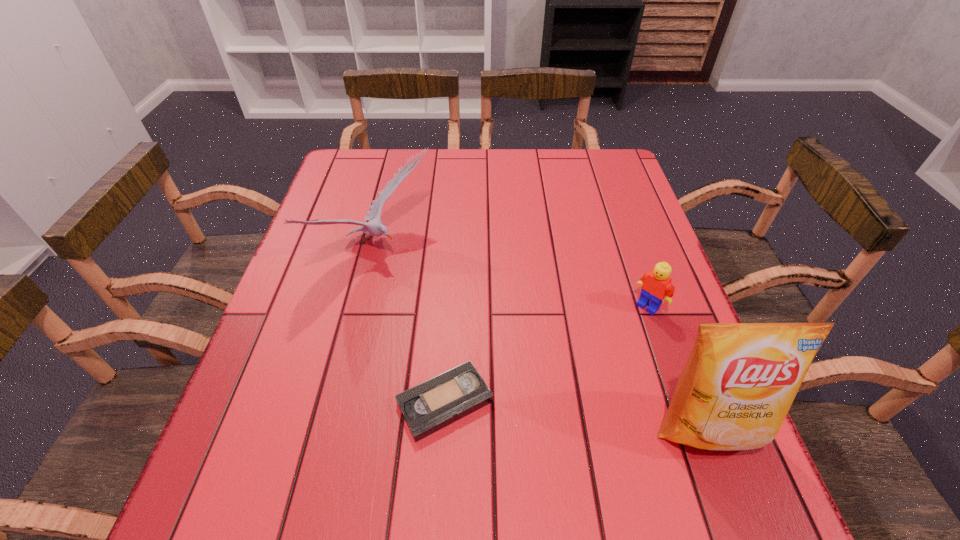
Find the location of a particular element. The width and height of the screenshot is (960, 540). free spot at the near edge of the desktop is located at coordinates (609, 432).

This screenshot has width=960, height=540. Identify the location of free space at the left edge of the desktop. (324, 278).

At what (x,y) coordinates should I click in order to perform the action: click on free space at the right edge of the desktop. Please return your answer as a coordinate pair (x, y). The height and width of the screenshot is (540, 960). Looking at the image, I should click on 630,232.

Locate an element on the screen. This screenshot has width=960, height=540. free space at the near left corner of the desktop is located at coordinates (266, 455).

You are a GUI agent. You are given a task and a screenshot of the screen. Output one action in this format:
    pyautogui.click(x=<x>, y=<y>)
    Task: Click on the vacant space at the far right corner of the desktop
    The image size is (960, 540).
    Given the screenshot: What is the action you would take?
    pyautogui.click(x=623, y=190)

What are the coordinates of `free space that is in between the shortest object and the crisp (potato chip)` in the screenshot? It's located at (576, 415).

This screenshot has width=960, height=540. I want to click on free space that is in between the second farthest object and the gull, so click(x=512, y=278).

This screenshot has height=540, width=960. What are the coordinates of `free space between the second shortest object and the gull` in the screenshot? It's located at (512, 278).

At what (x,y) coordinates should I click in order to perform the action: click on vacant space that's between the shortest object and the tallest object. Please return your answer as a coordinate pair (x, y). Looking at the image, I should click on (576, 415).

Find the location of a particular element. empty location between the Lego and the shortest object is located at coordinates (546, 354).